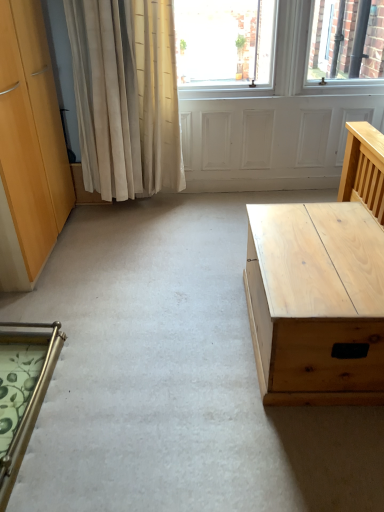
Question: Is light wood/texture desk at right bigger or smaller than gold metallic chair at lower left?

Choices:
 (A) small
 (B) big

Answer: (B)

Question: From the image's perspective, is light wood/texture desk at right positioned above or below gold metallic chair at lower left?

Choices:
 (A) above
 (B) below

Answer: (A)

Question: Based on their positions, is light wood/texture desk at right located to the left or right of gold metallic chair at lower left?

Choices:
 (A) left
 (B) right

Answer: (B)

Question: Considering the positions of gold metallic chair at lower left and light wood/texture desk at right in the image, is gold metallic chair at lower left wider or thinner than light wood/texture desk at right?

Choices:
 (A) wide
 (B) thin

Answer: (B)

Question: From a real-world perspective, is gold metallic chair at lower left positioned above or below light wood/texture desk at right?

Choices:
 (A) above
 (B) below

Answer: (B)

Question: Is gold metallic chair at lower left to the left or to the right of light wood/texture desk at right in the image?

Choices:
 (A) right
 (B) left

Answer: (B)

Question: Considering the positions of point (56, 324) and point (367, 288), is point (56, 324) closer or farther from the camera than point (367, 288)?

Choices:
 (A) farther
 (B) closer

Answer: (A)